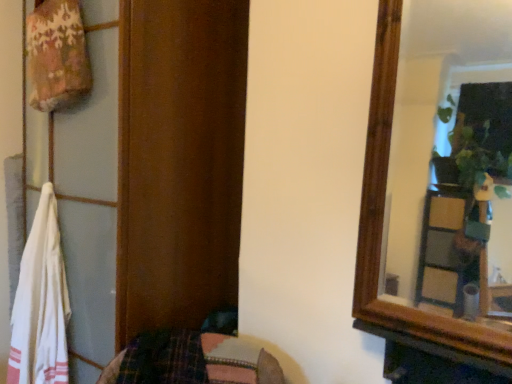
Question: Does wooden dresser at left have a smaller size compared to white cotton towel at left?

Choices:
 (A) yes
 (B) no

Answer: (B)

Question: Is wooden dresser at left closer to camera compared to white cotton towel at left?

Choices:
 (A) yes
 (B) no

Answer: (A)

Question: Are wooden dresser at left and white cotton towel at left making contact?

Choices:
 (A) no
 (B) yes

Answer: (A)

Question: Are wooden dresser at left and white cotton towel at left located far from each other?

Choices:
 (A) no
 (B) yes

Answer: (A)

Question: Is white cotton towel at left completely or partially inside wooden dresser at left?

Choices:
 (A) no
 (B) yes

Answer: (B)

Question: Can you confirm if wooden dresser at left is thinner than white cotton towel at left?

Choices:
 (A) no
 (B) yes

Answer: (A)

Question: Can we say white cotton towel at left lies outside wooden dresser at left?

Choices:
 (A) yes
 (B) no

Answer: (B)

Question: Is white cotton towel at left looking in the opposite direction of wooden dresser at left?

Choices:
 (A) no
 (B) yes

Answer: (B)

Question: Does white cotton towel at left touch wooden dresser at left?

Choices:
 (A) no
 (B) yes

Answer: (A)

Question: Is white cotton towel at left to the left of wooden dresser at left from the viewer's perspective?

Choices:
 (A) yes
 (B) no

Answer: (A)

Question: Does white cotton towel at left have a larger size compared to wooden dresser at left?

Choices:
 (A) yes
 (B) no

Answer: (B)

Question: Are white cotton towel at left and wooden dresser at left located far from each other?

Choices:
 (A) yes
 (B) no

Answer: (B)

Question: Considering the relative positions of white cotton towel at left and wooden dresser at left in the image provided, is white cotton towel at left to the left or to the right of wooden dresser at left?

Choices:
 (A) right
 (B) left

Answer: (B)